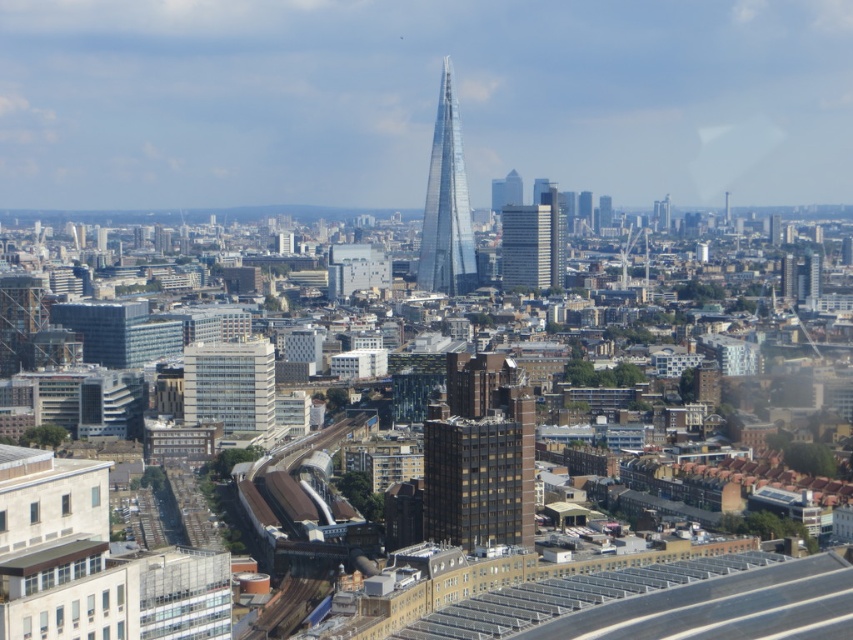
This screenshot has height=640, width=853. In order to click on brown brick building at center in this screenshot , I will do `click(480, 456)`.

What do you see at coordinates (480, 456) in the screenshot? This screenshot has height=640, width=853. I see `brown brick building at center` at bounding box center [480, 456].

Image resolution: width=853 pixels, height=640 pixels. What do you see at coordinates (480, 456) in the screenshot? I see `brown brick building at center` at bounding box center [480, 456].

You are a GUI agent. You are given a task and a screenshot of the screen. Output one action in this format:
    pyautogui.click(x=<x>, y=<y>)
    Task: Click on the brown brick building at center
    
    Given the screenshot: What is the action you would take?
    pyautogui.click(x=480, y=456)

Can you confirm if white glass skyscraper at center is taller than glassy steel skyscraper at center?

Incorrect, white glass skyscraper at center's height is not larger of glassy steel skyscraper at center's.

Is point (520, 232) in front of point (553, 212)?

Yes, point (520, 232) is closer to viewer.

Is point (521, 234) positioned after point (561, 262)?

No, it is in front of (561, 262).

Locate an element on the screen. white glass skyscraper at center is located at coordinates (526, 246).

Which is more to the right, brown brick building at center or glassy steel skyscraper at center?

glassy steel skyscraper at center is more to the right.

The height and width of the screenshot is (640, 853). What do you see at coordinates (480, 456) in the screenshot? I see `brown brick building at center` at bounding box center [480, 456].

Which is in front, point (456, 371) or point (553, 211)?

Point (456, 371) is in front.

Where is `brown brick building at center`? The height and width of the screenshot is (640, 853). brown brick building at center is located at coordinates (480, 456).